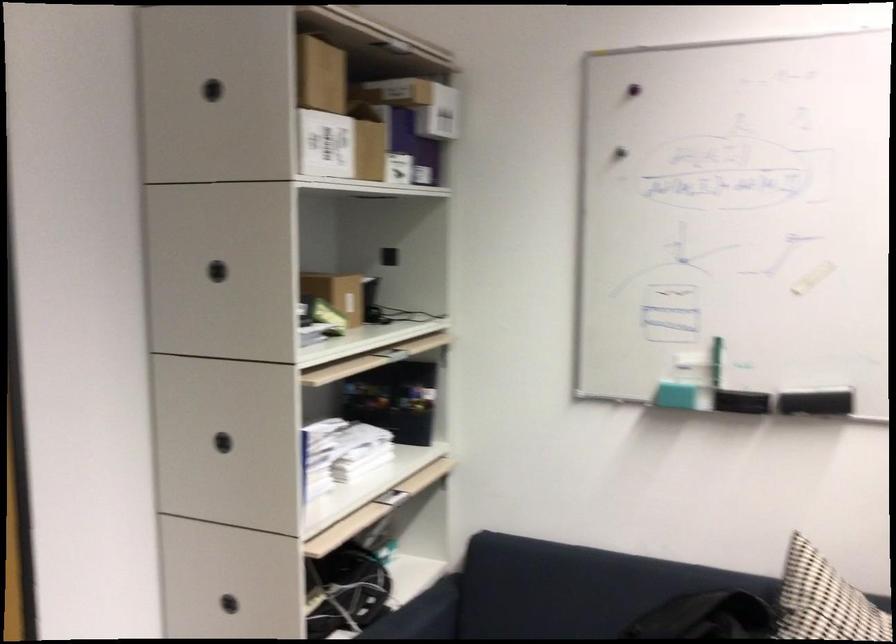
This screenshot has height=644, width=896. What do you see at coordinates (533, 625) in the screenshot?
I see `the sofa sitting surface` at bounding box center [533, 625].